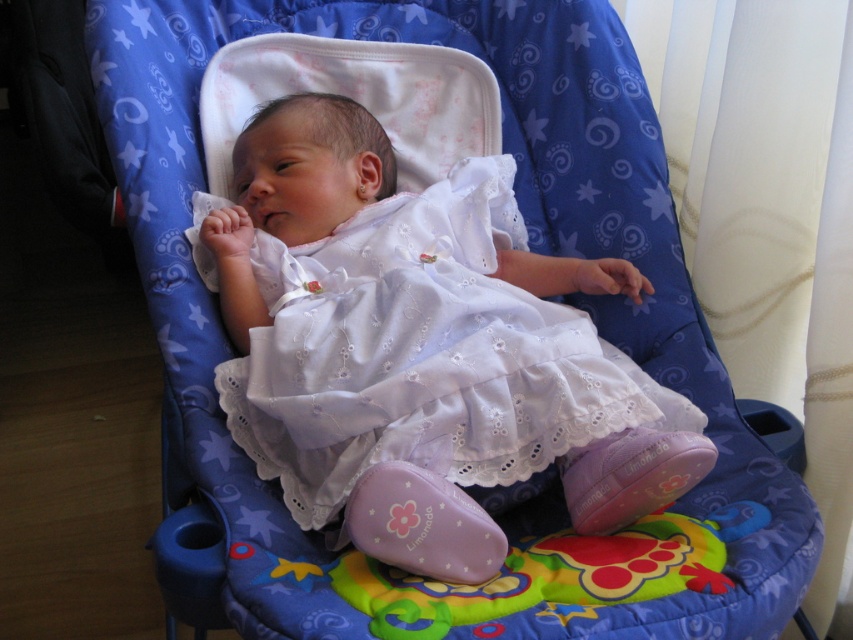
Question: Among these objects, which one is nearest to the camera?

Choices:
 (A) white lace dress at center
 (B) silver metallic teething ring at ear

Answer: (A)

Question: Is white lace dress at center to the right of silver metallic teething ring at ear from the viewer's perspective?

Choices:
 (A) yes
 (B) no

Answer: (A)

Question: From the image, what is the correct spatial relationship of white lace dress at center in relation to silver metallic teething ring at ear?

Choices:
 (A) left
 (B) right

Answer: (B)

Question: Can you confirm if white lace dress at center is positioned below silver metallic teething ring at ear?

Choices:
 (A) no
 (B) yes

Answer: (B)

Question: Which object appears closest to the camera in this image?

Choices:
 (A) white lace dress at center
 (B) silver metallic teething ring at ear

Answer: (A)